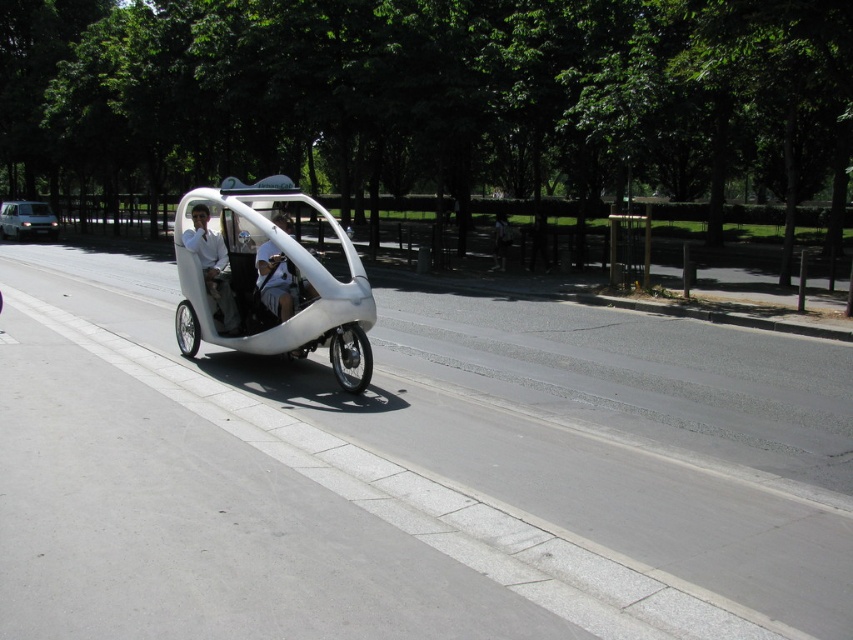
Does white matte helmet at center have a greater width compared to silver metallic van at left?

Yes.

Between point (286, 280) and point (28, 232), which one is positioned behind?

The point (28, 232) is more distant.

Where is `white matte helmet at center`? The image size is (853, 640). white matte helmet at center is located at coordinates (276, 280).

Image resolution: width=853 pixels, height=640 pixels. Describe the element at coordinates (212, 266) in the screenshot. I see `white matte car at center` at that location.

Is point (202, 220) positioned in front of point (3, 216)?

Yes, it is.

Who is more distant from viewer, (230, 294) or (51, 224)?

The point (51, 224) is behind.

Image resolution: width=853 pixels, height=640 pixels. What are the coordinates of `white matte car at center` in the screenshot? It's located at (212, 266).

Does white matte sidecar at center have a greater width compared to white matte helmet at center?

Yes.

Is point (234, 300) behind point (282, 273)?

Yes, point (234, 300) is farther from viewer.

Locate an element on the screen. white matte sidecar at center is located at coordinates (270, 278).